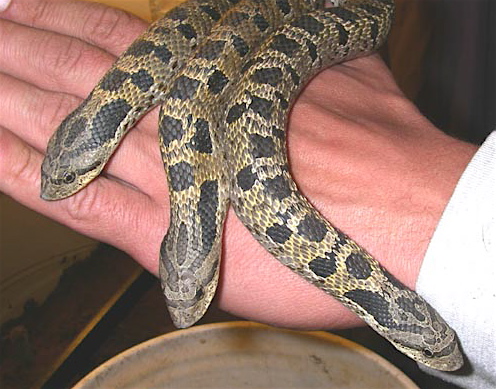
What are the coordinates of `white bowl` in the screenshot? It's located at (204, 357).